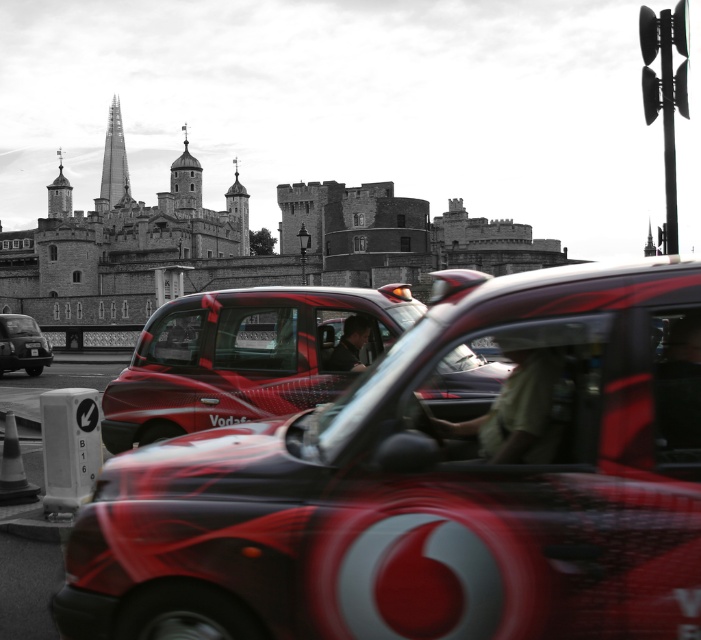
Is point (442, 499) farther from viewer compared to point (43, 355)?

No, it is in front of (43, 355).

How much distance is there between metallic red taxi at center and metallic silver car at left?

metallic red taxi at center is 59.75 meters away from metallic silver car at left.

Is point (435, 445) less distant than point (25, 360)?

Yes, it is in front of point (25, 360).

You are a GUI agent. You are given a task and a screenshot of the screen. Output one action in this format:
    pyautogui.click(x=<x>, y=<y>)
    Task: Click on the metallic red taxi at center
    The height and width of the screenshot is (640, 701).
    Given the screenshot: What is the action you would take?
    pyautogui.click(x=433, y=484)

Based on the photo, between metallic silver car at left and black plastic license plate at center, which one has more height?

metallic silver car at left is taller.

Does metallic silver car at left have a larger size compared to black plastic license plate at center?

Yes, metallic silver car at left is bigger than black plastic license plate at center.

Which is behind, point (32, 337) or point (32, 348)?

Point (32, 337)

Find the location of a particular element. Image resolution: width=701 pixels, height=640 pixels. metallic silver car at left is located at coordinates (20, 344).

Consider the image. Between metallic red taxi at center and black plastic license plate at center, which one is positioned higher?

black plastic license plate at center is higher up.

Who is more forward, (606, 308) or (34, 352)?

Positioned in front is point (606, 308).

Is point (512, 310) in front of point (29, 353)?

Yes, it is in front of point (29, 353).

Find the location of a particular element. Image resolution: width=701 pixels, height=640 pixels. metallic red taxi at center is located at coordinates (433, 484).